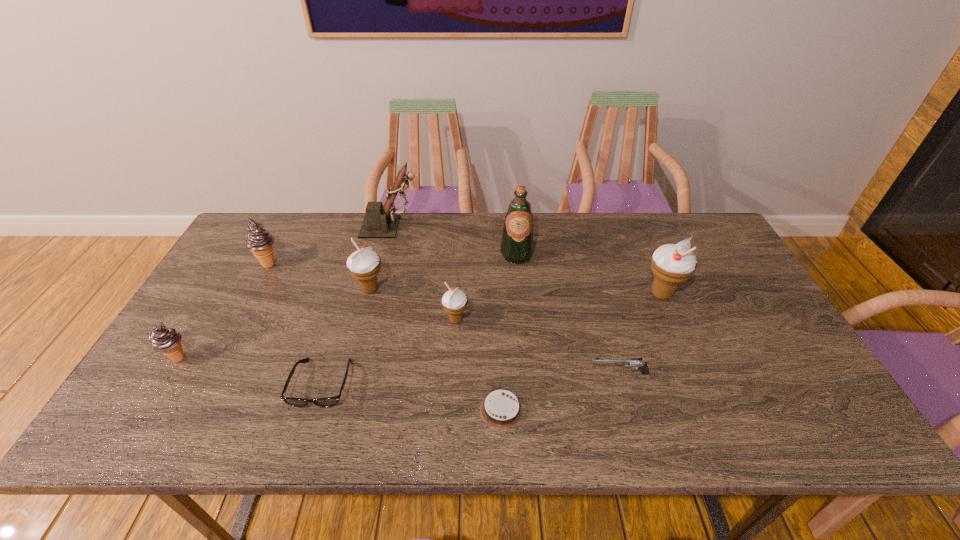
Where is `brown figurine`? This screenshot has height=540, width=960. brown figurine is located at coordinates (379, 222).

At what (x,y) coordinates should I click in order to perform the action: click on the farthest object. Please return your answer as a coordinate pair (x, y). This screenshot has height=540, width=960. Looking at the image, I should click on (379, 222).

The width and height of the screenshot is (960, 540). What are the coordinates of `olive oil` in the screenshot? It's located at (517, 240).

You are a GUI agent. You are given a task and a screenshot of the screen. Output one action in this format:
    pyautogui.click(x=<x>, y=<y>)
    Task: Click on the biggest white icecream
    Image resolution: width=960 pixels, height=540 pixels.
    Given the screenshot: What is the action you would take?
    pyautogui.click(x=672, y=264)

I want to click on the rightmost object, so click(672, 264).

At what (x,y) coordinates should I click in order to perform the action: click on the right chocolate icecream. Please return your answer as a coordinate pair (x, y). Image resolution: width=960 pixels, height=540 pixels. Looking at the image, I should click on (259, 241).

In order to click on the farther chocolate icecream in this screenshot , I will do `click(259, 241)`.

You are a GUI agent. You are given a task and a screenshot of the screen. Output one action in this format:
    pyautogui.click(x=<x>, y=<y>)
    Task: Click on the leftmost white icecream
    This screenshot has width=960, height=540.
    Given the screenshot: What is the action you would take?
    pyautogui.click(x=364, y=265)

This screenshot has height=540, width=960. Find the location of `the second smallest white icecream`. the second smallest white icecream is located at coordinates (364, 265).

Find the location of a particular element. This screenshot has height=540, width=960. the sixth farthest object is located at coordinates (454, 301).